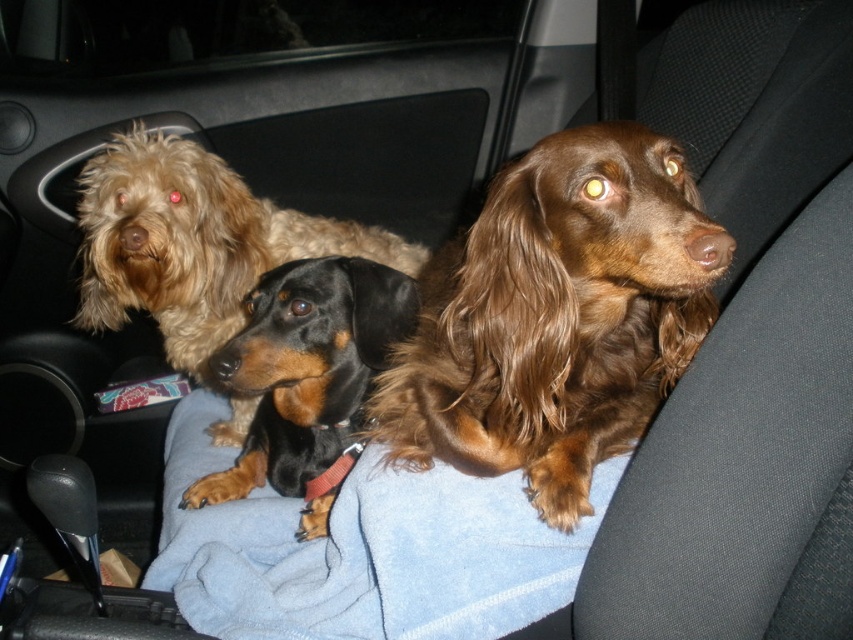
Who is higher up, blue fleece blanket at center or black smooth dachshund at center?

black smooth dachshund at center is above.

Can you confirm if blue fleece blanket at center is taller than black smooth dachshund at center?

No.

Is point (461, 593) positioned in front of point (223, 492)?

Yes, it is.

Locate an element on the screen. The height and width of the screenshot is (640, 853). blue fleece blanket at center is located at coordinates (363, 548).

Which is above, brown silky dog at center or black smooth dachshund at center?

Positioned higher is brown silky dog at center.

Is brown silky dog at center closer to the viewer compared to black smooth dachshund at center?

Yes.

The image size is (853, 640). In order to click on brown silky dog at center in this screenshot , I will do `click(556, 317)`.

Is point (373, 417) less distant than point (463, 554)?

No, (373, 417) is behind (463, 554).

The height and width of the screenshot is (640, 853). Describe the element at coordinates (556, 317) in the screenshot. I see `brown silky dog at center` at that location.

Which is in front, point (666, 202) or point (583, 541)?

Positioned in front is point (666, 202).

Locate an element on the screen. The image size is (853, 640). brown silky dog at center is located at coordinates pyautogui.click(x=556, y=317).